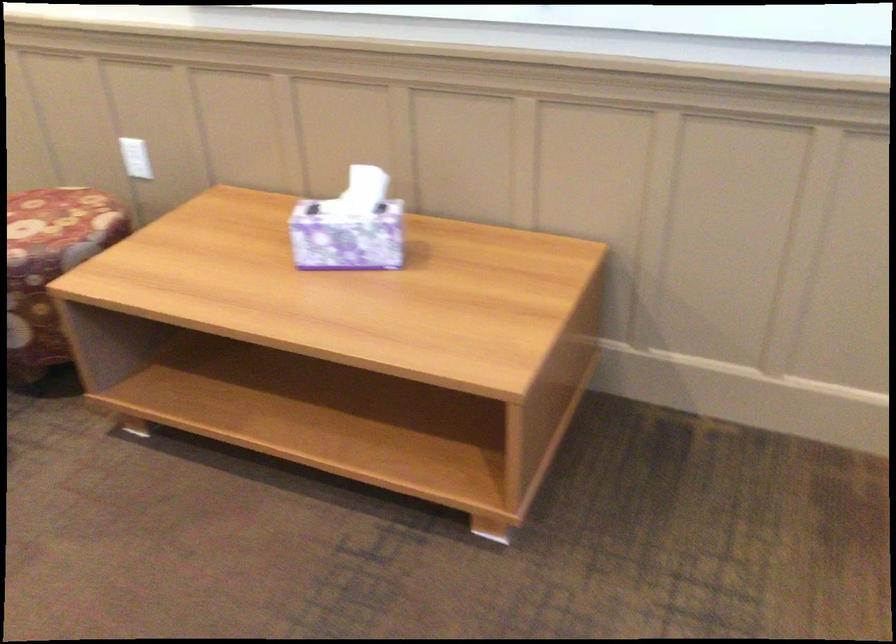
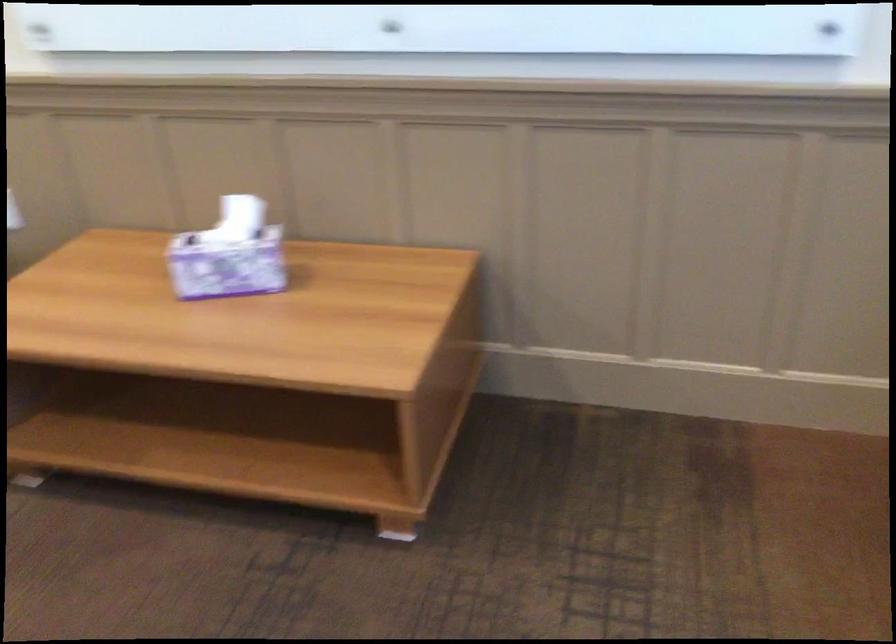
Question: The camera is either moving clockwise (left) or counter-clockwise (right) around the object. The first image is from the beginning of the video and the second image is from the end. Is the camera moving left or right when shooting the video?

Choices:
 (A) Left
 (B) Right

Answer: (A)